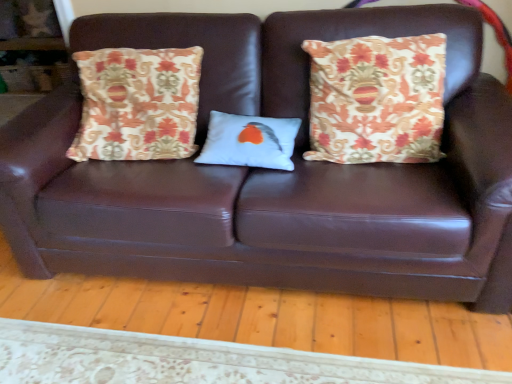
Locate an element on the screen. This screenshot has height=384, width=512. white matte pillow with bird design at center is located at coordinates (250, 141).

The width and height of the screenshot is (512, 384). Describe the element at coordinates (250, 141) in the screenshot. I see `white matte pillow with bird design at center` at that location.

Find the location of a particular element. The height and width of the screenshot is (384, 512). white matte pillow with bird design at center is located at coordinates (250, 141).